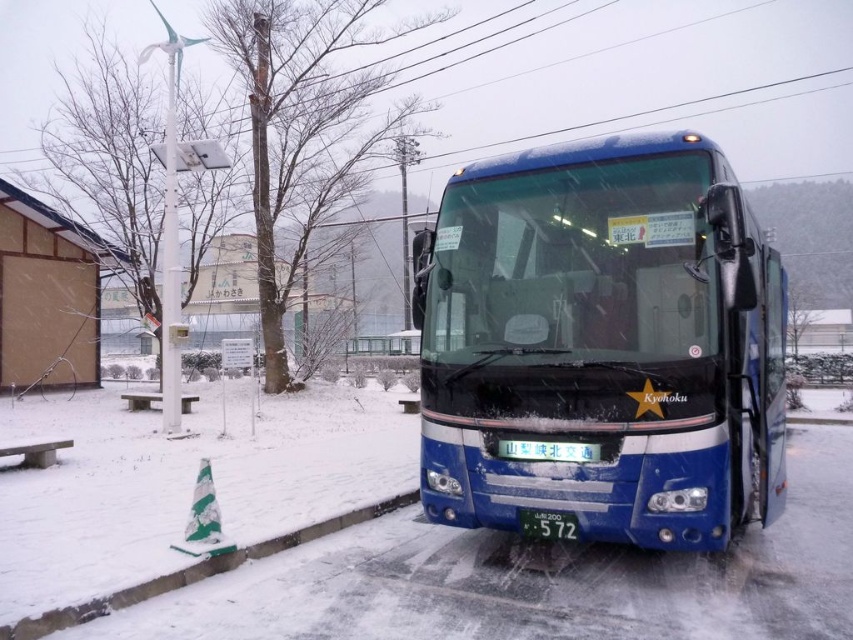
You are a bus driver who just arrived at the station. You notice two license plates on your blue Kyohoku bus. One is a green matte license plate at center and the other is a green plastic license plate at center. Which license plate is taller?

The green plastic license plate at center is taller than the green matte license plate at center.

Consider the image. You are a pedestrian trying to cross the road near the bus stop. There is a blue metallic bus at center and a green striped cone at lower left. Which object is closer to the road edge?

The green striped cone at lower left is closer to the road edge since it is positioned below the blue metallic bus at center, which is further away from the edge.

You are standing at the bus stop and want to board the blue metallic bus at center. The boarding ramp is 1.2 meters high. Can you reach the boarding ramp?

The blue metallic bus at center is 4.84 meters from viewer. Since the boarding ramp is 1.2 meters high, you can reach it as long as you are close enough. However, the distance from the viewer to the bus is 4.84 meters, which is too far to reach the boarding ramp directly. You need to move closer to the bus first.